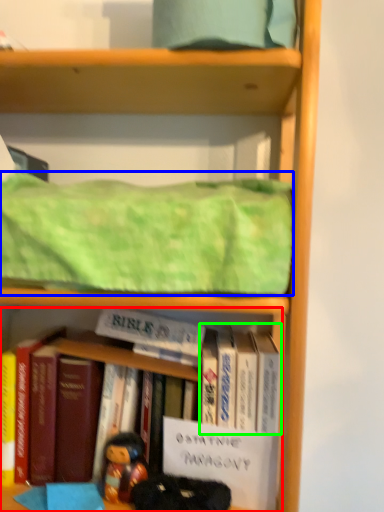
Question: Considering the real-world distances, which object is farthest from book (highlighted by a red box)? blanket (highlighted by a blue box) or book (highlighted by a green box)?

Choices:
 (A) blanket
 (B) book

Answer: (A)